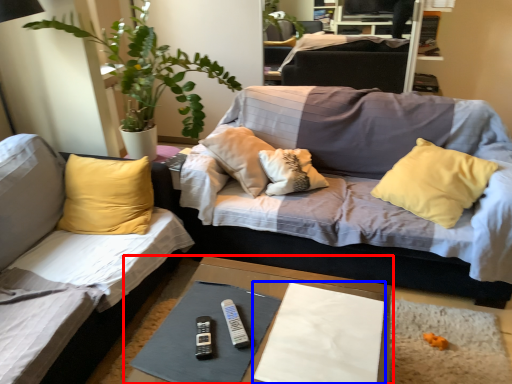
Question: Among these objects, which one is farthest to the camera, table (highlighted by a red box) or sheet (highlighted by a blue box)?

Choices:
 (A) table
 (B) sheet

Answer: (B)